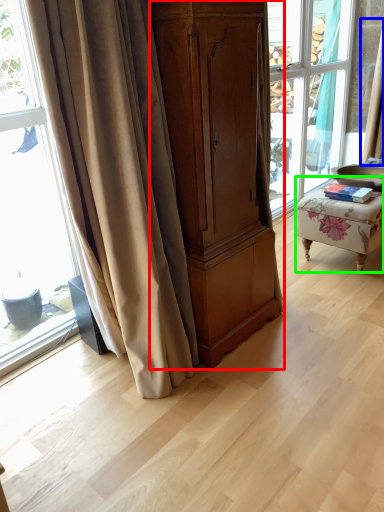
Question: Based on their relative distances, which object is farther from cabinetry (highlighted by a red box)? Choose from curtain (highlighted by a blue box) and furniture (highlighted by a green box).

Choices:
 (A) curtain
 (B) furniture

Answer: (A)